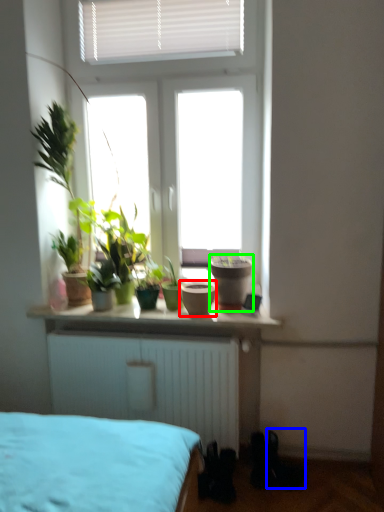
Question: Which is farther away from flowerpot (highlighted by a red box)? shoe (highlighted by a blue box) or flowerpot (highlighted by a green box)?

Choices:
 (A) shoe
 (B) flowerpot

Answer: (A)